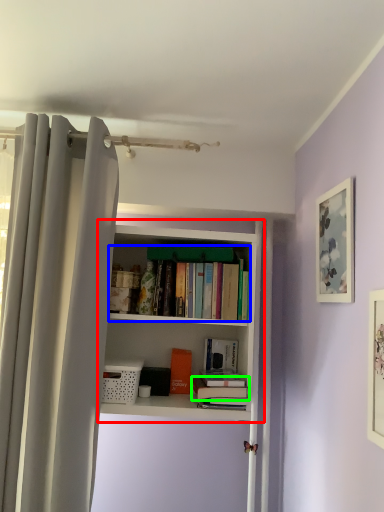
Question: Which is nearer to the bookcase (highlighted by a red box)? book (highlighted by a blue box) or book (highlighted by a green box).

Choices:
 (A) book
 (B) book

Answer: (A)